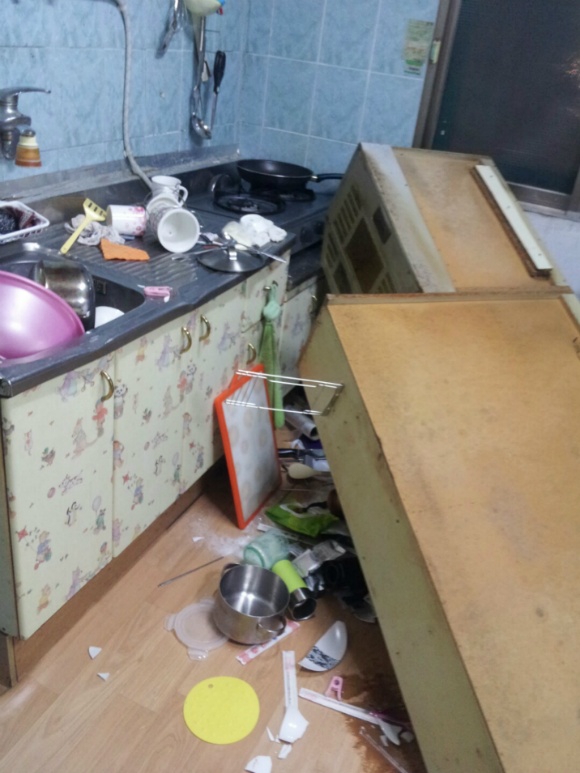
Find the location of `stovetop`. stovetop is located at coordinates (300, 208).